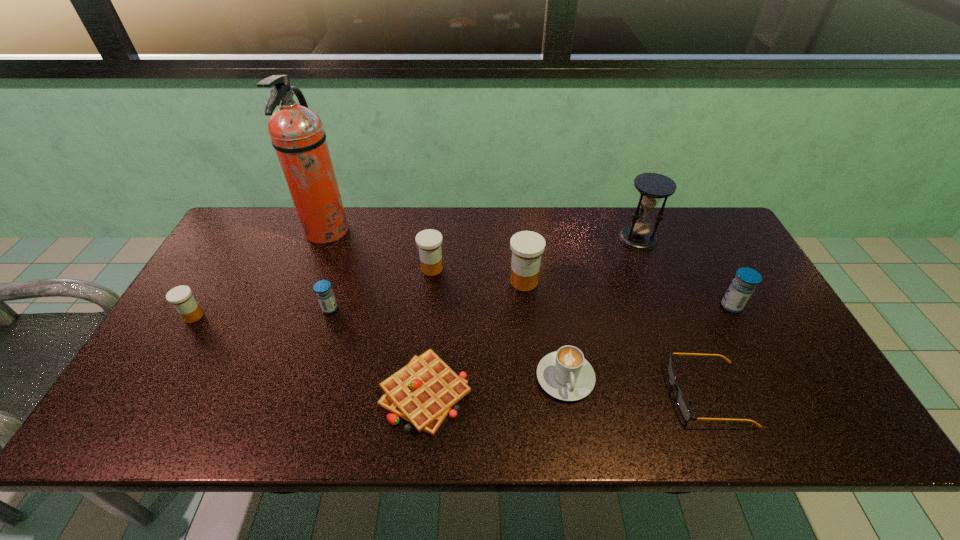
I want to click on vacant space situated on the label of the third tallest object, so click(470, 281).

The width and height of the screenshot is (960, 540). What are the coordinates of `free location located on the label of the second smallest orange medicine` in the screenshot? It's located at [564, 268].

Locate an element on the screen. free region located 0.360m on the back of the rightmost object is located at coordinates (685, 219).

Where is `vacant space located on the right of the second medicine from left to right`? This screenshot has width=960, height=540. vacant space located on the right of the second medicine from left to right is located at coordinates (484, 309).

Where is `vacant space located 0.110m on the label of the leftmost medicine`? The image size is (960, 540). vacant space located 0.110m on the label of the leftmost medicine is located at coordinates (245, 316).

Locate an element on the screen. The image size is (960, 540). vacant space situated 0.080m to the right of the cappuccino is located at coordinates (575, 437).

You are a GUI agent. You are given a task and a screenshot of the screen. Output one action in this format:
    pyautogui.click(x=<x>, y=<y>)
    Task: Click on the free location located on the front-facing side of the spectacles
    The width and height of the screenshot is (960, 540).
    Given the screenshot: What is the action you would take?
    pyautogui.click(x=593, y=394)

Image resolution: width=960 pixels, height=540 pixels. Identify the location of free space located on the front-facing side of the spectacles. (554, 394).

This screenshot has height=540, width=960. Identify the location of blank area located on the front-facing side of the spectacles. (576, 394).

Locate an element on the screen. The width and height of the screenshot is (960, 540). blank space located on the left of the waffle is located at coordinates (x=286, y=393).